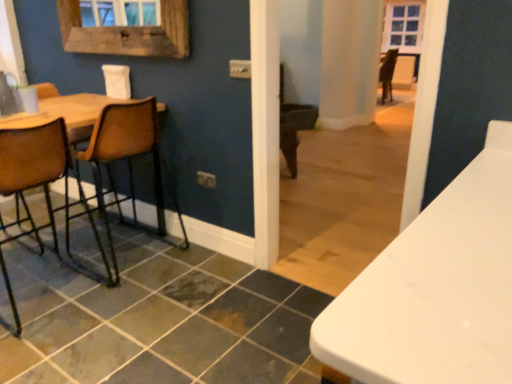
Question: Is wooden frame at upper left surrounding wooden seat at left, marked as the 1th chair in a left-to-right arrangement?

Choices:
 (A) no
 (B) yes

Answer: (A)

Question: From a real-world perspective, is wooden frame at upper left positioned under wooden seat at left, which is counted as the 2th chair, starting from the right, based on gravity?

Choices:
 (A) yes
 (B) no

Answer: (B)

Question: Is wooden frame at upper left with wooden seat at left, marked as the 1th chair in a left-to-right arrangement?

Choices:
 (A) no
 (B) yes

Answer: (A)

Question: From the image's perspective, is wooden frame at upper left over wooden seat at left, which is counted as the 2th chair, starting from the right?

Choices:
 (A) yes
 (B) no

Answer: (A)

Question: Is wooden frame at upper left thinner than wooden seat at left, marked as the 1th chair in a left-to-right arrangement?

Choices:
 (A) yes
 (B) no

Answer: (A)

Question: Is wooden frame at upper left smaller than wooden seat at left, which is counted as the 2th chair, starting from the right?

Choices:
 (A) yes
 (B) no

Answer: (A)

Question: Can you confirm if brown leather chair at left, which is counted as the 1th chair, starting from the right, is positioned to the left of wooden frame at upper left?

Choices:
 (A) no
 (B) yes

Answer: (A)

Question: Does brown leather chair at left, which is counted as the 1th chair, starting from the right, have a greater width compared to wooden frame at upper left?

Choices:
 (A) no
 (B) yes

Answer: (B)

Question: Can you confirm if brown leather chair at left, which is the 2th chair from left to right, is positioned to the right of wooden frame at upper left?

Choices:
 (A) no
 (B) yes

Answer: (B)

Question: Does brown leather chair at left, which is the 2th chair from left to right, have a larger size compared to wooden frame at upper left?

Choices:
 (A) no
 (B) yes

Answer: (B)

Question: Can you confirm if brown leather chair at left, which is the 2th chair from left to right, is taller than wooden frame at upper left?

Choices:
 (A) no
 (B) yes

Answer: (B)

Question: From the image's perspective, does brown leather chair at left, which is the 2th chair from left to right, appear lower than wooden frame at upper left?

Choices:
 (A) yes
 (B) no

Answer: (A)

Question: Does slate tile at lower left lie behind wooden frame at upper left?

Choices:
 (A) no
 (B) yes

Answer: (A)